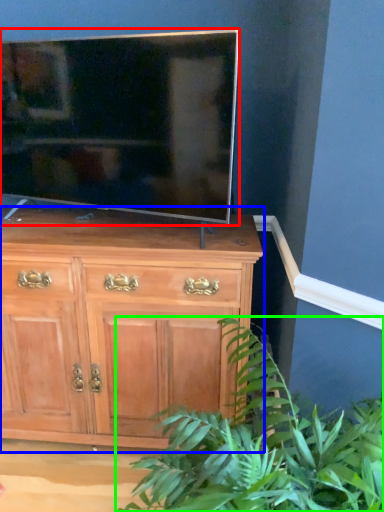
Question: Which is farther away from television (highlighted by a red box)? chest of drawers (highlighted by a blue box) or houseplant (highlighted by a green box)?

Choices:
 (A) chest of drawers
 (B) houseplant

Answer: (B)